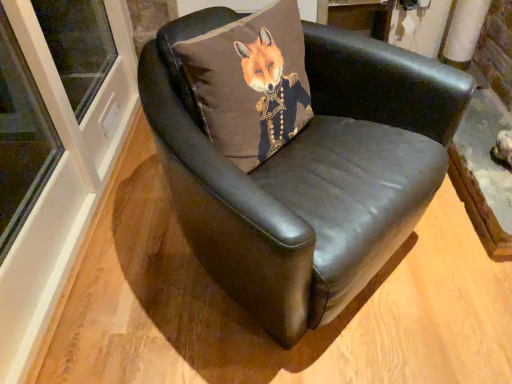
Describe the element at coordinates (250, 82) in the screenshot. I see `brown fabric pillow at center` at that location.

Measure the distance between point (221, 50) and camera.

Point (221, 50) is 3.57 feet from camera.

In the scene shown: What is the approximate height of brown fabric pillow at center?

14.68 inches.

Find the location of `brown fabric pillow at center`. brown fabric pillow at center is located at coordinates (250, 82).

Describe the element at coordinates (307, 172) in the screenshot. I see `black leather chair at center` at that location.

This screenshot has width=512, height=384. I want to click on black leather chair at center, so click(307, 172).

This screenshot has width=512, height=384. I want to click on brown fabric pillow at center, so click(250, 82).

Considering the relative positions of black leather chair at center and brown fabric pillow at center in the image provided, is black leather chair at center to the left of brown fabric pillow at center from the viewer's perspective?

In fact, black leather chair at center is to the right of brown fabric pillow at center.

Considering their positions, is black leather chair at center located in front of or behind brown fabric pillow at center?

Clearly, black leather chair at center is in front of brown fabric pillow at center.

Does point (174, 187) come farther from viewer compared to point (212, 121)?

No, (174, 187) is in front of (212, 121).

From the image's perspective, which is below, black leather chair at center or brown fabric pillow at center?

black leather chair at center appears lower in the image.

From a real-world perspective, who is located lower, black leather chair at center or brown fabric pillow at center?

black leather chair at center is physically lower.

Is black leather chair at center wider than brown fabric pillow at center?

Yes.

Considering the relative sizes of black leather chair at center and brown fabric pillow at center in the image provided, is black leather chair at center taller than brown fabric pillow at center?

Correct, black leather chair at center is much taller as brown fabric pillow at center.

From the picture: Can you confirm if black leather chair at center is smaller than brown fabric pillow at center?

No, black leather chair at center is not smaller than brown fabric pillow at center.

Is brown fabric pillow at center located within black leather chair at center?

Yes, brown fabric pillow at center is surrounded by black leather chair at center.

Is black leather chair at center with brown fabric pillow at center?

No, black leather chair at center is not touching brown fabric pillow at center.

Is black leather chair at center oriented towards brown fabric pillow at center?

No, black leather chair at center is not turned towards brown fabric pillow at center.

How many degrees apart are the facing directions of black leather chair at center and brown fabric pillow at center?

The angle between the facing direction of black leather chair at center and the facing direction of brown fabric pillow at center is 0.00147 degrees.

Measure the distance from black leather chair at center to brown fabric pillow at center.

black leather chair at center and brown fabric pillow at center are 7.35 inches apart.

I want to click on pillow above the black leather chair at center (from a real-world perspective), so click(x=250, y=82).

Which object is positioned more to the left, brown fabric pillow at center or black leather chair at center?

brown fabric pillow at center is more to the left.

Which is in front, brown fabric pillow at center or black leather chair at center?

black leather chair at center is more forward.

Is point (236, 51) farther from viewer compared to point (282, 311)?

Yes.

From the image's perspective, who appears lower, brown fabric pillow at center or black leather chair at center?

black leather chair at center, from the image's perspective.

From a real-world perspective, which object stands above the other?

brown fabric pillow at center, from a real-world perspective.

Does brown fabric pillow at center have a greater width compared to black leather chair at center?

No.

Which of these two, brown fabric pillow at center or black leather chair at center, stands taller?

black leather chair at center is taller.

Which of these two, brown fabric pillow at center or black leather chair at center, is bigger?

black leather chair at center is bigger.

Is brown fabric pillow at center outside of black leather chair at center?

Actually, brown fabric pillow at center is within black leather chair at center.

Are brown fabric pillow at center and black leather chair at center making contact?

No, brown fabric pillow at center is not touching black leather chair at center.

Is brown fabric pillow at center oriented towards black leather chair at center?

Yes, brown fabric pillow at center is turned towards black leather chair at center.

How many degrees apart are the facing directions of brown fabric pillow at center and black leather chair at center?

The angular difference between brown fabric pillow at center and black leather chair at center is 0.00147 degrees.

Where is `pillow that is behind the black leather chair at center`? The height and width of the screenshot is (384, 512). pillow that is behind the black leather chair at center is located at coordinates (250, 82).

You are a GUI agent. You are given a task and a screenshot of the screen. Output one action in this format:
    pyautogui.click(x=<x>, y=<y>)
    Task: Click on the pillow behind the black leather chair at center
    This screenshot has width=512, height=384.
    Given the screenshot: What is the action you would take?
    pyautogui.click(x=250, y=82)

Locate an element on the screen. This screenshot has width=512, height=384. pillow that is above the black leather chair at center (from the image's perspective) is located at coordinates (250, 82).